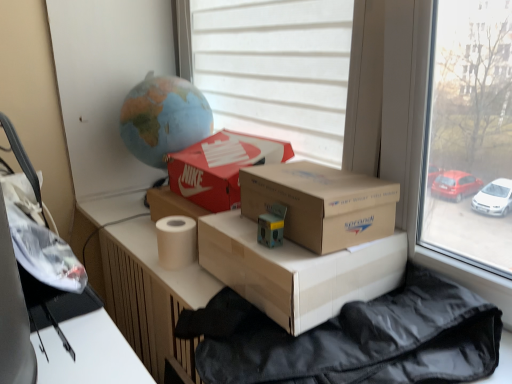
Question: Relative to beige matte toilet paper at center, is white matte window at center, the 1th window from the left, in front or behind?

Choices:
 (A) front
 (B) behind

Answer: (A)

Question: Is white matte window at center, the 1th window from the left, situated inside beige matte toilet paper at center or outside?

Choices:
 (A) outside
 (B) inside

Answer: (A)

Question: Which object is positioned closest to the matte cardboard box at center, which is the first box from top to bottom?

Choices:
 (A) black synthetic sleeping bag at lower right
 (B) white matte window at center, the second window viewed from the right
 (C) white cardboard box at center
 (D) transparent glass window at upper right, acting as the second window starting from the left
 (E) matte cardboard box at center, which is the 3th box from top to bottom

Answer: (B)

Question: Which of these objects is positioned closest to the transparent glass window at upper right, acting as the second window starting from the left?

Choices:
 (A) beige matte toilet paper at center
 (B) white cardboard box at center
 (C) matte cardboard box at center, which is the 3th box from top to bottom
 (D) matte cardboard box at center, the 3th box in the bottom-to-top sequence
 (E) matte green plastic toy at center

Answer: (C)